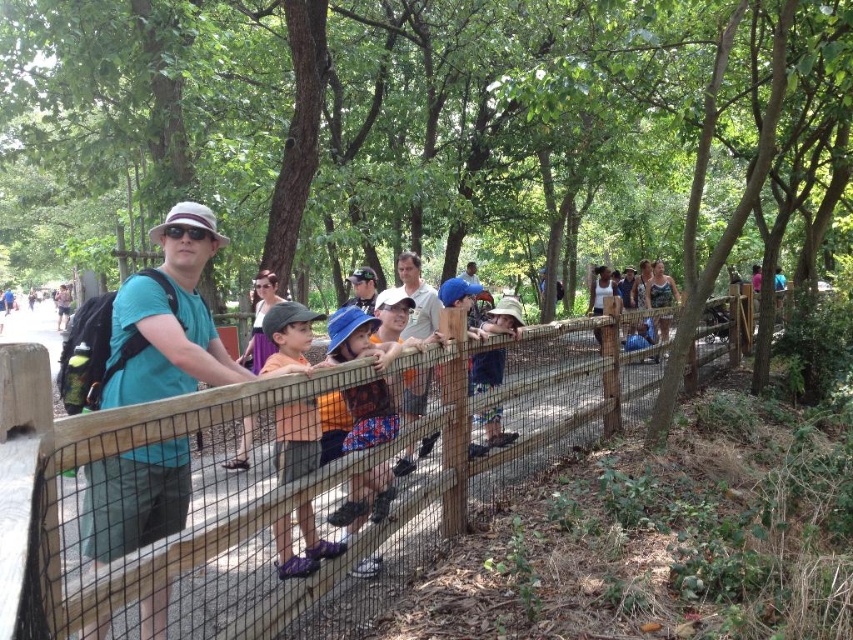
You are standing at the point marked as point (477, 419) in the zoo scene. You want to reach a snack stand located exactly 5 meters away from your current position. Is the snack stand within your immediate reach? Please explain.

The distance between point (477, 419) and the viewer is 4.95 meters. Since the snack stand is located exactly 5 meters away from your current position, it is just slightly beyond your immediate reach as 4.95 meters is less than 5 meters, but the exact distance required is not met.

You are a photographer trying to capture a group photo of the people at the zoo. You need to ensure everyone fits in the frame. The camera you are using has a maximum capture width of 6 feet. Given the distance between the blue denim shorts at center and the purple satin dress at center, will everyone in the group fit within the camera frame?

The distance between the blue denim shorts at center and the purple satin dress at center is 6.90 feet. Since the camera can only capture up to 6 feet, the group is slightly too wide to fit within the frame.

You are a photographer taking pictures of the orange fabric shirt at center and the purple satin dress at center in the zoo scene. Which clothing item appears smaller in your photos?

The orange fabric shirt at center appears smaller in the photos because it has a smaller size compared to the purple satin dress at center.